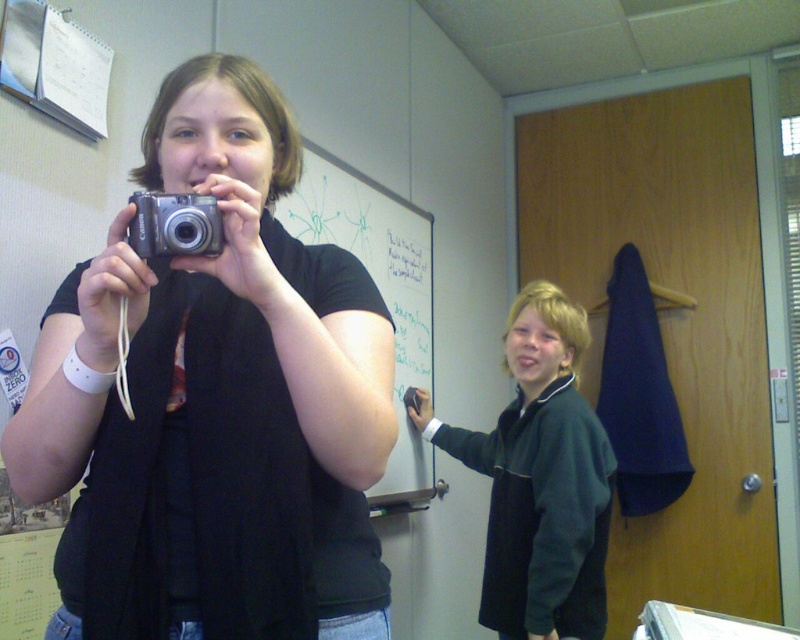
You are standing in the room and want to take a picture of the whiteboard at upper center using your phone camera. Since the whiteboard is at a specific location, can you estimate its position relative to the edges of the room? Please provide coordinates if possible.

The whiteboard at upper center is located at coordinates point (380, 292).

You are a photographer trying to capture the whiteboard at upper center in your shot. You have a silver metallic camera at center. Can you adjust your camera to include the whiteboard in the frame?

The whiteboard at upper center is located below the silver metallic camera at center, so adjusting the camera downward might allow you to include the whiteboard in the frame.

You are standing 30 inches away from a point in the scene. Is the point you are looking at closer to you than the point labeled as point (156,388)?

The distance of point (156,388) from viewer is 32.60 inches. Since you are standing 30 inches away from a point in the scene, the point you are looking at is closer to you than point (156,388).